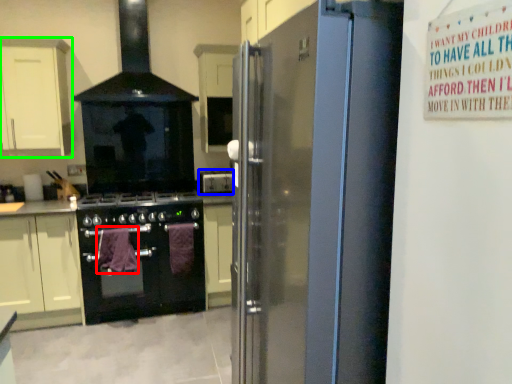
Question: Considering the real-world distances, which object is closest to blanket (highlighted by a red box)? appliance (highlighted by a blue box) or cabinetry (highlighted by a green box).

Choices:
 (A) appliance
 (B) cabinetry

Answer: (A)